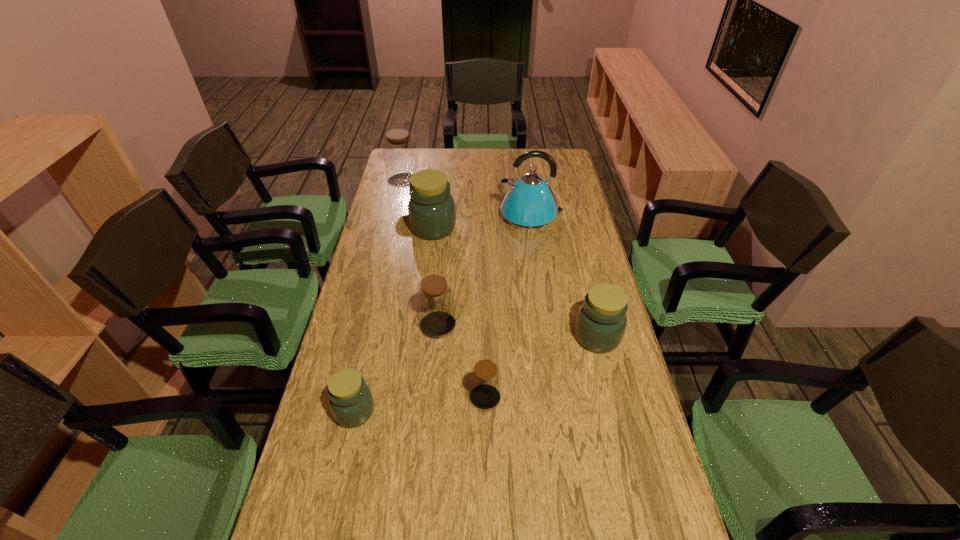
Identify the location of kettle. This screenshot has height=540, width=960. (529, 204).

Where is `the farthest brown jar`? The height and width of the screenshot is (540, 960). the farthest brown jar is located at coordinates (400, 156).

I want to click on the farthest jar, so click(x=400, y=156).

Where is `the biggest green jar`? This screenshot has width=960, height=540. the biggest green jar is located at coordinates [431, 208].

The width and height of the screenshot is (960, 540). In order to click on the fifth nearest jar in this screenshot , I will do `click(431, 208)`.

Image resolution: width=960 pixels, height=540 pixels. Identify the location of the second brown jar from right to left. (435, 301).

Image resolution: width=960 pixels, height=540 pixels. I want to click on the second biggest brown jar, so click(435, 301).

This screenshot has width=960, height=540. Identify the location of the rightmost green jar. pos(600,325).

Where is `the second smallest green jar`? the second smallest green jar is located at coordinates (600, 325).

Locate an element on the screen. the rightmost brown jar is located at coordinates (485, 379).